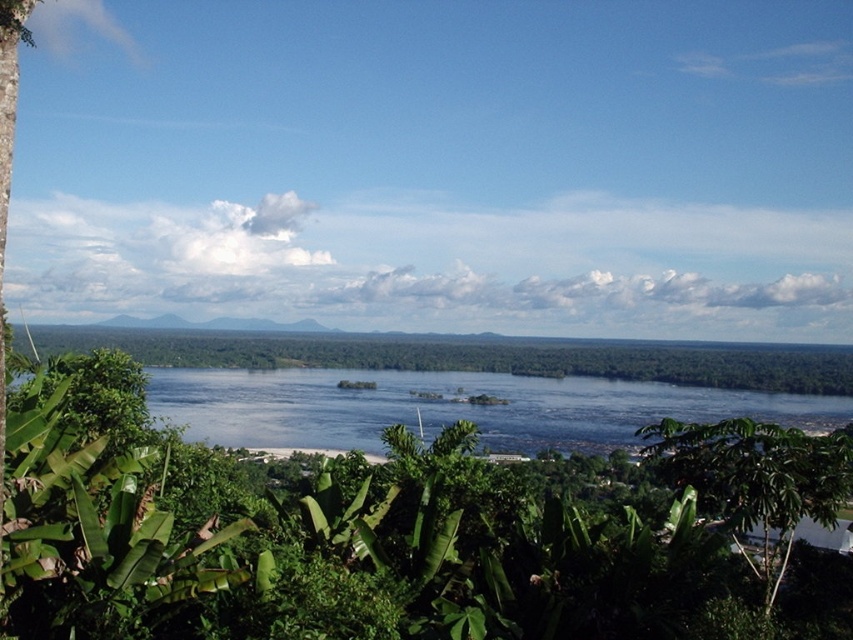
You are a bird flying over the tropical landscape. You see the green leafy tree at center and the green leafy tree at lower right. Which tree is located to the right of the other?

The green leafy tree at center is positioned on the right side of green leafy tree at lower right.